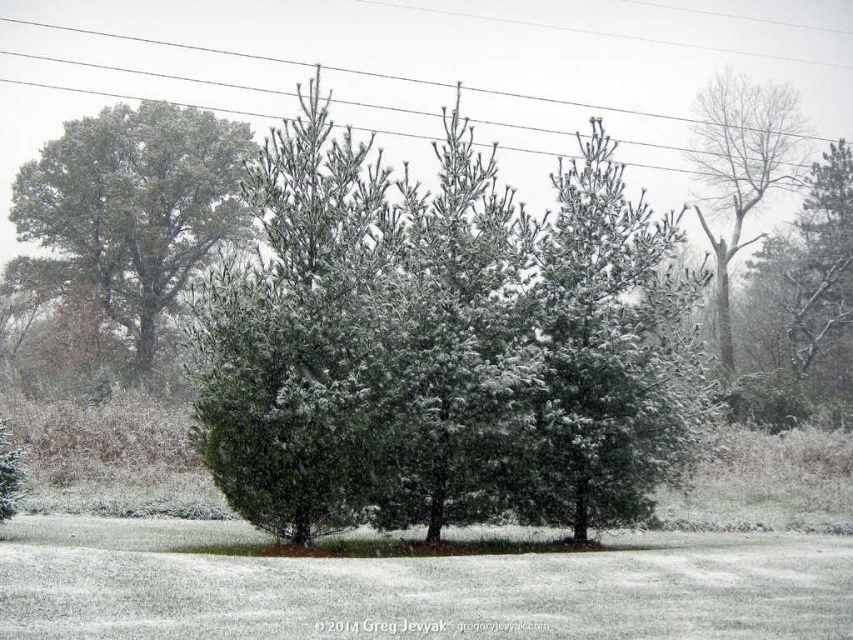
Question: Which point appears closest to the camera in this image?

Choices:
 (A) (622, 449)
 (B) (833, 67)

Answer: (A)

Question: In this image, where is green matte tree at upper left located relative to bare wood tree at upper right?

Choices:
 (A) right
 (B) left

Answer: (B)

Question: Among these points, which one is farthest from the camera?

Choices:
 (A) (724, 289)
 (B) (734, 125)
 (C) (282, 170)
 (D) (238, 227)

Answer: (B)

Question: Can you confirm if snow-covered pine tree at center is wider than bare wood tree at upper right?

Choices:
 (A) no
 (B) yes

Answer: (B)

Question: Which object appears farthest from the camera in this image?

Choices:
 (A) green matte tree at upper left
 (B) snow-covered pine tree at center
 (C) bare wood tree at upper right

Answer: (A)

Question: Can you confirm if snow-covered pine tree at center is wider than metallic wire at upper center?

Choices:
 (A) no
 (B) yes

Answer: (A)